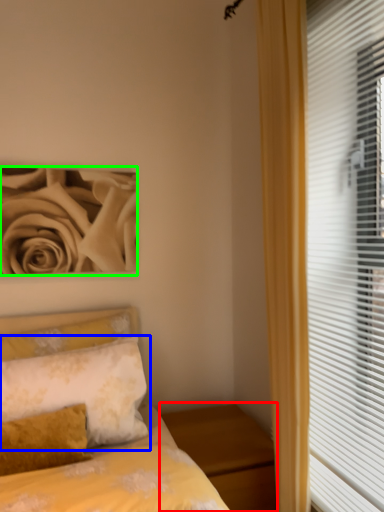
Question: Which is farther away from nightstand (highlighted by a red box)? pillow (highlighted by a blue box) or rose (highlighted by a green box)?

Choices:
 (A) pillow
 (B) rose

Answer: (B)